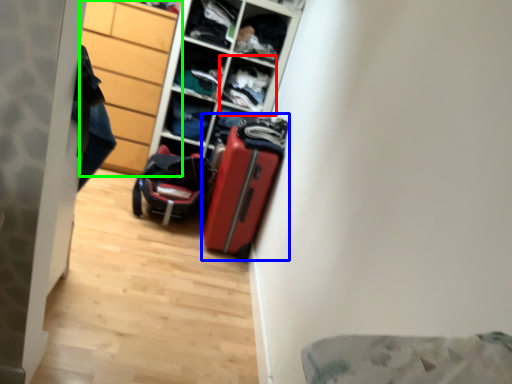
Question: Which object is the farthest from cabinet (highlighted by a red box)? Choose among these: suitcase (highlighted by a blue box) or cabinetry (highlighted by a green box).

Choices:
 (A) suitcase
 (B) cabinetry

Answer: (A)